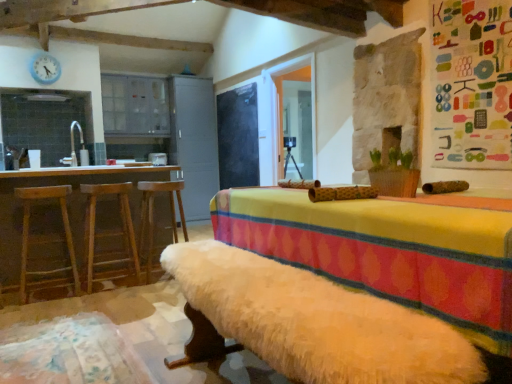
Locate an element on the screen. The image size is (512, 384). free space above white plastic clock at upper left (from a real-world perspective) is located at coordinates (45, 54).